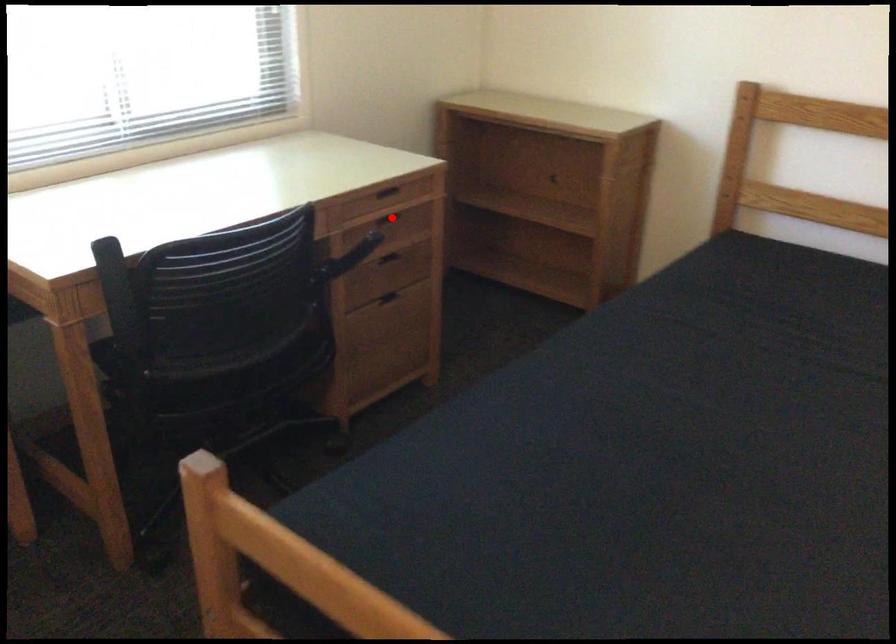
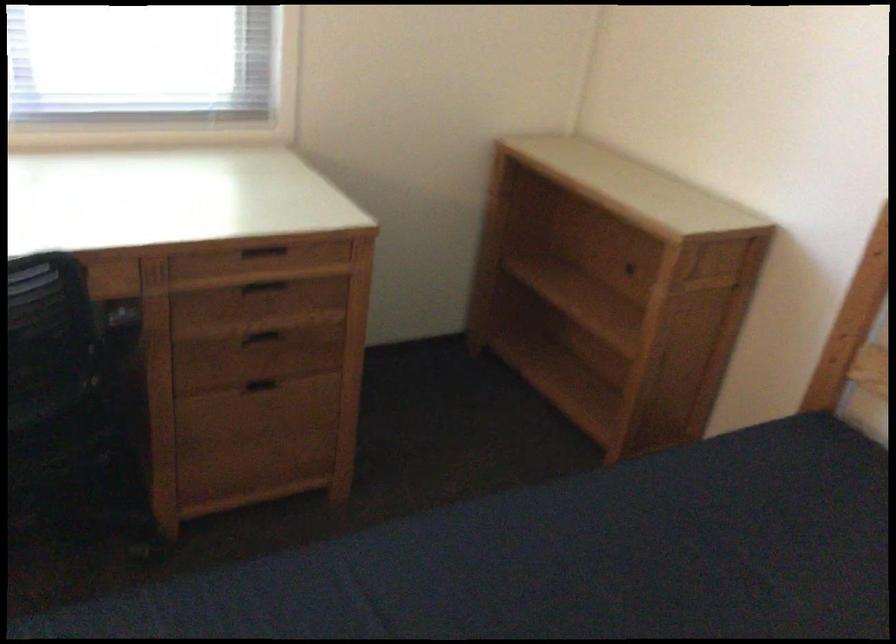
Question: I am providing you with two images of the same scene from different viewpoints. A red point is shown in image1. For the corresponding object point in image2, is it positioned nearer or farther from the camera?

Choices:
 (A) Nearer
 (B) Farther

Answer: (A)